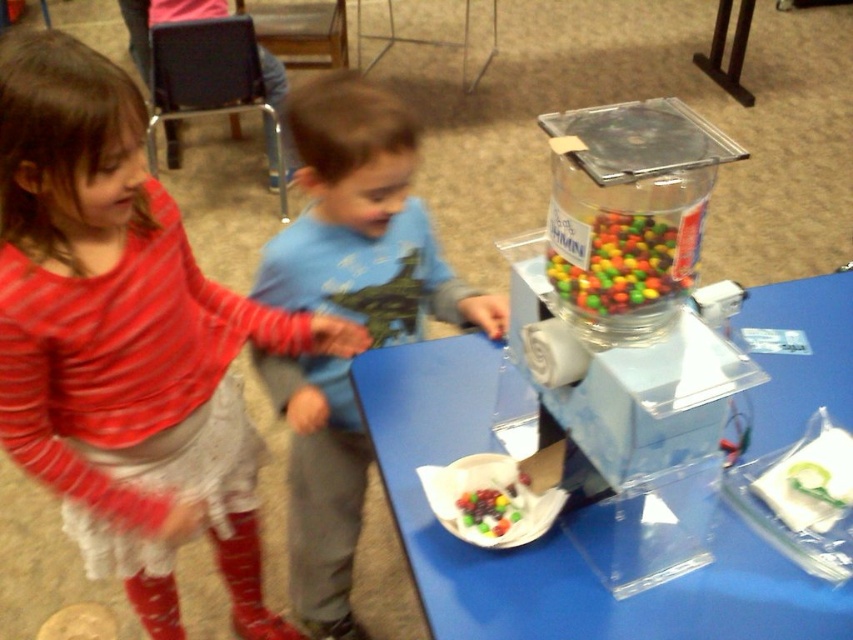
Question: Which object is closer to the camera taking this photo?

Choices:
 (A) shiny multicolored candies at center
 (B) blue cotton shirt at center

Answer: (A)

Question: Is blue plastic table at center smaller than multicolored glossy candy at center?

Choices:
 (A) yes
 (B) no

Answer: (B)

Question: Is blue cotton shirt at center bigger than shiny multicolored candies at center?

Choices:
 (A) no
 (B) yes

Answer: (B)

Question: Which object is positioned farthest from the blue cotton shirt at center?

Choices:
 (A) shiny multicolored candies at center
 (B) striped cotton shirt at upper left
 (C) multicolored glossy candy at center
 (D) blue plastic table at center

Answer: (C)

Question: Is blue cotton shirt at center above multicolored glossy candy at center?

Choices:
 (A) no
 (B) yes

Answer: (A)

Question: Which object is farther from the camera taking this photo?

Choices:
 (A) blue plastic table at center
 (B) striped cotton shirt at upper left
 (C) multicolored glossy candy at center

Answer: (A)